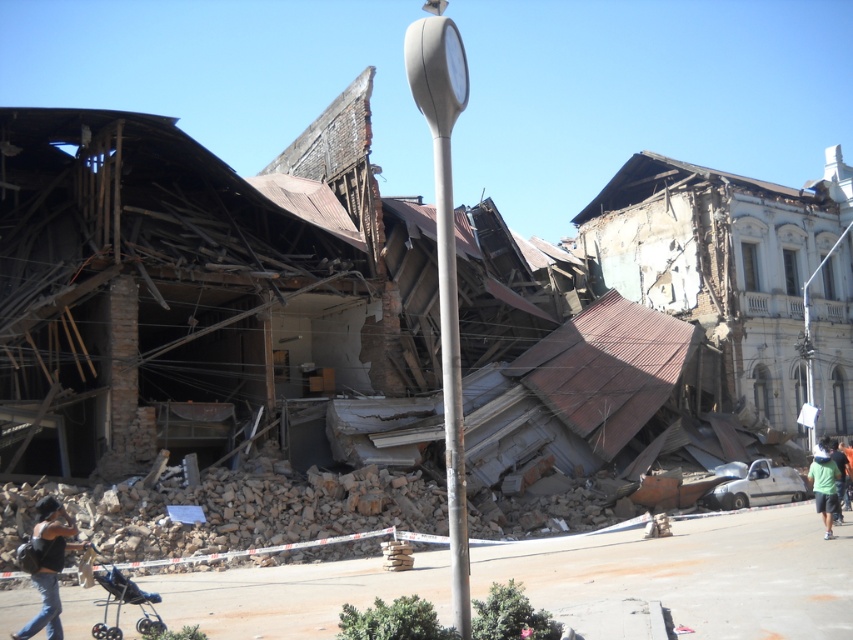
Can you confirm if metallic gray pole at center is taller than black plastic baby carriage at lower left?

Yes.

Between point (451, 237) and point (131, 589), which one is positioned behind?

The point (131, 589) is more distant.

Who is more distant from viewer, (463, 508) or (144, 593)?

Positioned behind is point (144, 593).

Locate an element on the screen. metallic gray pole at center is located at coordinates (451, 385).

Does dark gray fabric backpack at lower left have a lesser height compared to green fabric shirt at lower right?

Yes, dark gray fabric backpack at lower left is shorter than green fabric shirt at lower right.

How much distance is there between dark gray fabric backpack at lower left and green fabric shirt at lower right?

dark gray fabric backpack at lower left is 17.72 meters from green fabric shirt at lower right.

Is point (26, 627) in front of point (831, 497)?

Yes.

Identify the location of dark gray fabric backpack at lower left. (49, 564).

Which of these two, metallic gray pole at center or dark gray fabric backpack at lower left, stands shorter?

With less height is dark gray fabric backpack at lower left.

Which is in front, point (445, 186) or point (62, 540)?

Point (445, 186)

Is point (456, 387) positioned after point (48, 550)?

No, (456, 387) is in front of (48, 550).

Locate an element on the screen. metallic gray pole at center is located at coordinates (451, 385).